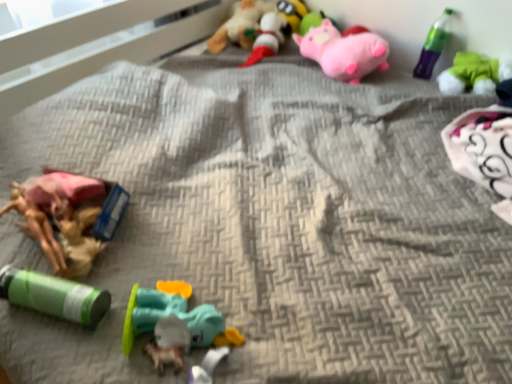
Measure the distance between green matte cylinder at lower left, positioned as the 5th toy in top-to-bottom order, and camera.

green matte cylinder at lower left, positioned as the 5th toy in top-to-bottom order, is 84.03 centimeters from camera.

Find the location of a particular element. The height and width of the screenshot is (384, 512). teal rubber duck at center, the 6th toy when ordered from top to bottom is located at coordinates (173, 324).

At what (x,y) coordinates should I click in order to perform the action: click on pink plush pig at upper right, positioned as the 6th toy in bottom-to-top order. Please return your answer as a coordinate pair (x, y). The image size is (512, 384). Looking at the image, I should click on (344, 51).

The height and width of the screenshot is (384, 512). Describe the element at coordinates (169, 343) in the screenshot. I see `rubberized plastic toy at center, which is the 7th toy in top-to-bottom order` at that location.

What are the coordinates of `green matte cylinder at lower left, which appears as the 4th toy when ordered from the bottom` in the screenshot? It's located at (54, 295).

Which is in front, point (23, 294) or point (287, 30)?

Positioned in front is point (23, 294).

Between green matte cylinder at lower left, positioned as the 5th toy in top-to-bottom order, and pink plush toy at upper center, the first toy when ordered from top to bottom, which one has smaller size?

green matte cylinder at lower left, positioned as the 5th toy in top-to-bottom order, is smaller.

Considering the relative sizes of green matte cylinder at lower left, positioned as the 5th toy in top-to-bottom order, and pink plush toy at upper center, marked as the eighth toy in a bottom-to-top arrangement, in the image provided, is green matte cylinder at lower left, positioned as the 5th toy in top-to-bottom order, wider than pink plush toy at upper center, marked as the eighth toy in a bottom-to-top arrangement,?

Yes, green matte cylinder at lower left, positioned as the 5th toy in top-to-bottom order, is wider than pink plush toy at upper center, marked as the eighth toy in a bottom-to-top arrangement.

Based on the photo, are green matte cylinder at lower left, positioned as the 5th toy in top-to-bottom order, and pink plush toy at upper center, the first toy when ordered from top to bottom, making contact?

They are not placed beside each other.

Is green plush toy at upper right, placed as the 4th toy when sorted from top to bottom, facing away from rubberized plastic toy at center, which appears as the 2th toy when ordered from the bottom?

No, green plush toy at upper right, placed as the 4th toy when sorted from top to bottom, is not facing away from rubberized plastic toy at center, which appears as the 2th toy when ordered from the bottom.

Between green plush toy at upper right, placed as the 4th toy when sorted from top to bottom, and rubberized plastic toy at center, which is the 7th toy in top-to-bottom order, which one has more height?

green plush toy at upper right, placed as the 4th toy when sorted from top to bottom, is taller.

Which is more to the left, green plush toy at upper right, placed as the 4th toy when sorted from top to bottom, or rubberized plastic toy at center, which is the 7th toy in top-to-bottom order?

rubberized plastic toy at center, which is the 7th toy in top-to-bottom order, is more to the left.

In the image, is soft plush toy at upper center, which is counted as the 2th toy, starting from the top, on the left side or the right side of green plush toy at upper right, the fifth toy ordered from the bottom?

From the image, it's evident that soft plush toy at upper center, which is counted as the 2th toy, starting from the top, is to the left of green plush toy at upper right, the fifth toy ordered from the bottom.

Does soft plush toy at upper center, which is counted as the 2th toy, starting from the top, have a greater width compared to green plush toy at upper right, placed as the 4th toy when sorted from top to bottom?

Yes.

Does soft plush toy at upper center, the 7th toy positioned from the bottom, have a larger size compared to green plush toy at upper right, placed as the 4th toy when sorted from top to bottom?

Yes.

From the image's perspective, which is below, soft plush toy at upper center, the 7th toy positioned from the bottom, or green plush toy at upper right, the fifth toy ordered from the bottom?

green plush toy at upper right, the fifth toy ordered from the bottom, is shown below in the image.

From the image's perspective, is teal rubber duck at center, the 6th toy when ordered from top to bottom, located above or below soft plush toy at upper center, the 7th toy positioned from the bottom?

teal rubber duck at center, the 6th toy when ordered from top to bottom, is situated lower than soft plush toy at upper center, the 7th toy positioned from the bottom, in the image.

Is teal rubber duck at center, the 6th toy when ordered from top to bottom, to the right of soft plush toy at upper center, which is counted as the 2th toy, starting from the top, from the viewer's perspective?

No.

Identify the location of the 4th toy above the teal rubber duck at center, the 6th toy when ordered from top to bottom (from the image's perspective). (240, 25).

Is teal rubber duck at center, the 6th toy when ordered from top to bottom, inside the boundaries of soft plush toy at upper center, which is counted as the 2th toy, starting from the top, or outside?

The correct answer is: outside.

Is point (170, 344) positioned before point (440, 27)?

Yes, it is.

Is there a large distance between rubberized plastic toy at center, which is the 7th toy in top-to-bottom order, and green plastic bottle at upper right?

Absolutely, rubberized plastic toy at center, which is the 7th toy in top-to-bottom order, is distant from green plastic bottle at upper right.

In terms of size, does rubberized plastic toy at center, which appears as the 2th toy when ordered from the bottom, appear bigger or smaller than green plastic bottle at upper right?

In the image, rubberized plastic toy at center, which appears as the 2th toy when ordered from the bottom, appears to be smaller than green plastic bottle at upper right.

Is green plush toy at upper right, placed as the 4th toy when sorted from top to bottom, turned away from green plastic bottle at upper right?

No, green plush toy at upper right, placed as the 4th toy when sorted from top to bottom, is not facing away from green plastic bottle at upper right.

From a real-world perspective, is green plush toy at upper right, placed as the 4th toy when sorted from top to bottom, physically below green plastic bottle at upper right?

Yes, from a real-world perspective, green plush toy at upper right, placed as the 4th toy when sorted from top to bottom, is under green plastic bottle at upper right.

Which object is closer to the camera taking this photo, green plush toy at upper right, the fifth toy ordered from the bottom, or green plastic bottle at upper right?

green plush toy at upper right, the fifth toy ordered from the bottom.

I want to click on toy that is on the right side of green plastic bottle at upper right, so click(x=474, y=74).

Are green plush toy at upper right, the fifth toy ordered from the bottom, and green matte cylinder at lower left, positioned as the 5th toy in top-to-bottom order, far apart?

Yes, green plush toy at upper right, the fifth toy ordered from the bottom, and green matte cylinder at lower left, positioned as the 5th toy in top-to-bottom order, are quite far apart.

Between green plush toy at upper right, placed as the 4th toy when sorted from top to bottom, and green matte cylinder at lower left, which appears as the 4th toy when ordered from the bottom, which one appears on the right side from the viewer's perspective?

From the viewer's perspective, green plush toy at upper right, placed as the 4th toy when sorted from top to bottom, appears more on the right side.

Locate an element on the screen. This screenshot has height=384, width=512. toy that is the 1st object above the green matte cylinder at lower left, positioned as the 5th toy in top-to-bottom order (from a real-world perspective) is located at coordinates (474, 74).

Could you tell me if green plush toy at upper right, the fifth toy ordered from the bottom, is facing green matte cylinder at lower left, positioned as the 5th toy in top-to-bottom order?

Yes, green plush toy at upper right, the fifth toy ordered from the bottom, faces towards green matte cylinder at lower left, positioned as the 5th toy in top-to-bottom order.

The height and width of the screenshot is (384, 512). I want to click on the 5th toy counting from the left side of the pink plush toy at upper center, marked as the eighth toy in a bottom-to-top arrangement, so click(54, 295).

This screenshot has height=384, width=512. Identify the location of the 3rd toy below the green plush toy at upper right, the fifth toy ordered from the bottom (from the image's perspective). (169, 343).

Looking at the image, which one is located closer to green matte cylinder at lower left, which appears as the 4th toy when ordered from the bottom, soft plush toy at upper center, which is counted as the 2th toy, starting from the top, or pink plush toy at upper center, marked as the eighth toy in a bottom-to-top arrangement?

Among the two, soft plush toy at upper center, which is counted as the 2th toy, starting from the top, is located nearer to green matte cylinder at lower left, which appears as the 4th toy when ordered from the bottom.

When comparing their distances from translucent plastic toy at center, the 8th toy positioned from the top, does pink plush pig at upper right, positioned as the 6th toy in bottom-to-top order, or green plastic bottle at upper right seem further?

green plastic bottle at upper right is positioned further to the anchor translucent plastic toy at center, the 8th toy positioned from the top.

Looking at the image, which one is located further to green plush toy at upper right, the fifth toy ordered from the bottom, pink plush pig at upper right, the 3th toy positioned from the top, or green matte cylinder at lower left, which appears as the 4th toy when ordered from the bottom?

green matte cylinder at lower left, which appears as the 4th toy when ordered from the bottom, lies further to green plush toy at upper right, the fifth toy ordered from the bottom, than the other object.

When comparing their distances from pink plush pig at upper right, positioned as the 6th toy in bottom-to-top order, does rubberized plastic toy at center, which is the 7th toy in top-to-bottom order, or soft plush toy at upper center, the 7th toy positioned from the bottom, seem closer?

Among the two, soft plush toy at upper center, the 7th toy positioned from the bottom, is located nearer to pink plush pig at upper right, positioned as the 6th toy in bottom-to-top order.

Based on their spatial positions, is pink plush pig at upper right, the 3th toy positioned from the top, or green plastic bottle at upper right further from soft plush toy at upper center, the 7th toy positioned from the bottom?

Among the two, green plastic bottle at upper right is located further to soft plush toy at upper center, the 7th toy positioned from the bottom.

Based on their spatial positions, is teal rubber duck at center, arranged as the third toy when ordered from the bottom, or green plush toy at upper right, the fifth toy ordered from the bottom, closer to soft plush toy at upper center, the 7th toy positioned from the bottom?

green plush toy at upper right, the fifth toy ordered from the bottom, is positioned closer to the anchor soft plush toy at upper center, the 7th toy positioned from the bottom.

From the image, which object appears to be farther from green plastic bottle at upper right, green matte cylinder at lower left, which appears as the 4th toy when ordered from the bottom, or rubberized plastic toy at center, which appears as the 2th toy when ordered from the bottom?

green matte cylinder at lower left, which appears as the 4th toy when ordered from the bottom.

When comparing their distances from green matte cylinder at lower left, positioned as the 5th toy in top-to-bottom order, does translucent plastic toy at center, the 8th toy positioned from the top, or pink plush pig at upper right, positioned as the 6th toy in bottom-to-top order, seem further?

pink plush pig at upper right, positioned as the 6th toy in bottom-to-top order, is positioned further to the anchor green matte cylinder at lower left, positioned as the 5th toy in top-to-bottom order.

Locate an element on the screen. bottle between soft plush toy at upper center, the 7th toy positioned from the bottom, and teal rubber duck at center, the 6th toy when ordered from top to bottom, in the vertical direction is located at coordinates click(x=433, y=45).

The width and height of the screenshot is (512, 384). I want to click on bottle between green matte cylinder at lower left, which appears as the 4th toy when ordered from the bottom, and green plush toy at upper right, placed as the 4th toy when sorted from top to bottom, so click(433, 45).

This screenshot has height=384, width=512. I want to click on bottle between pink plush toy at upper center, marked as the eighth toy in a bottom-to-top arrangement, and translucent plastic toy at center, positioned as the first toy in bottom-to-top order, vertically, so click(433, 45).

The height and width of the screenshot is (384, 512). In order to click on bottle between pink plush pig at upper right, positioned as the 6th toy in bottom-to-top order, and teal rubber duck at center, the 6th toy when ordered from top to bottom, in the vertical direction in this screenshot , I will do `click(433, 45)`.